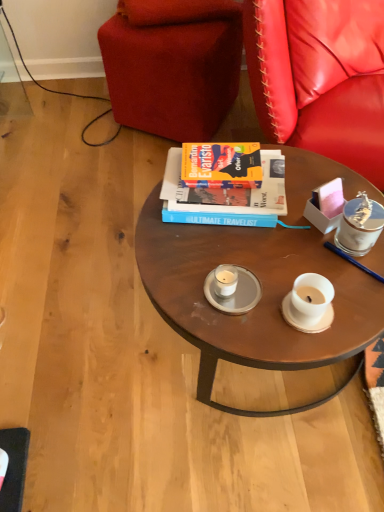
Find the location of a particular element. This screenshot has height=512, width=384. free spot behind clear glass saucer at center is located at coordinates (236, 239).